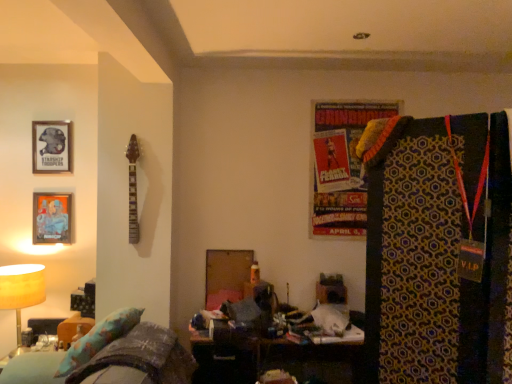
Question: From the image's perspective, is matte yellow lampshade at left above metallic silver picture frame at upper left, which appears as the 2th picture frame when ordered from the bottom?

Choices:
 (A) yes
 (B) no

Answer: (B)

Question: Can you confirm if matte yellow lampshade at left is positioned to the left of metallic silver picture frame at upper left, which appears as the 2th picture frame when ordered from the bottom?

Choices:
 (A) yes
 (B) no

Answer: (A)

Question: Is matte yellow lampshade at left wider than metallic silver picture frame at upper left, which appears as the 2th picture frame when ordered from the bottom?

Choices:
 (A) yes
 (B) no

Answer: (A)

Question: Is matte yellow lampshade at left in contact with metallic silver picture frame at upper left, positioned as the 1th picture frame in top-to-bottom order?

Choices:
 (A) yes
 (B) no

Answer: (B)

Question: Considering the relative sizes of matte yellow lampshade at left and metallic silver picture frame at upper left, positioned as the 1th picture frame in top-to-bottom order, in the image provided, is matte yellow lampshade at left thinner than metallic silver picture frame at upper left, positioned as the 1th picture frame in top-to-bottom order,?

Choices:
 (A) no
 (B) yes

Answer: (A)

Question: In terms of size, does fluffy fabric couch at lower left appear bigger or smaller than matte yellow lampshade at left?

Choices:
 (A) big
 (B) small

Answer: (A)

Question: Is fluffy fabric couch at lower left to the left or to the right of matte yellow lampshade at left in the image?

Choices:
 (A) left
 (B) right

Answer: (B)

Question: Is point [x=59, y=352] positioned closer to the camera than point [x=8, y=296]?

Choices:
 (A) closer
 (B) farther

Answer: (A)

Question: Would you say fluffy fabric couch at lower left is inside or outside matte yellow lampshade at left?

Choices:
 (A) outside
 (B) inside

Answer: (A)

Question: Is fluffy fabric couch at lower left taller or shorter than metallic silver picture frame at left, the 1th picture frame ordered from the bottom?

Choices:
 (A) tall
 (B) short

Answer: (A)

Question: Considering the positions of fluffy fabric couch at lower left and metallic silver picture frame at left, the 1th picture frame ordered from the bottom, in the image, is fluffy fabric couch at lower left wider or thinner than metallic silver picture frame at left, the 1th picture frame ordered from the bottom,?

Choices:
 (A) wide
 (B) thin

Answer: (A)

Question: Is fluffy fabric couch at lower left to the left or to the right of metallic silver picture frame at left, which is the second picture frame from top to bottom, in the image?

Choices:
 (A) left
 (B) right

Answer: (B)

Question: From the image's perspective, is fluffy fabric couch at lower left located above or below metallic silver picture frame at left, the 1th picture frame ordered from the bottom?

Choices:
 (A) below
 (B) above

Answer: (A)

Question: Is matte yellow lampshade at left situated inside metallic silver picture frame at upper left, positioned as the 1th picture frame in top-to-bottom order, or outside?

Choices:
 (A) inside
 (B) outside

Answer: (B)

Question: Looking at the image, does matte yellow lampshade at left seem bigger or smaller compared to metallic silver picture frame at upper left, which appears as the 2th picture frame when ordered from the bottom?

Choices:
 (A) big
 (B) small

Answer: (A)